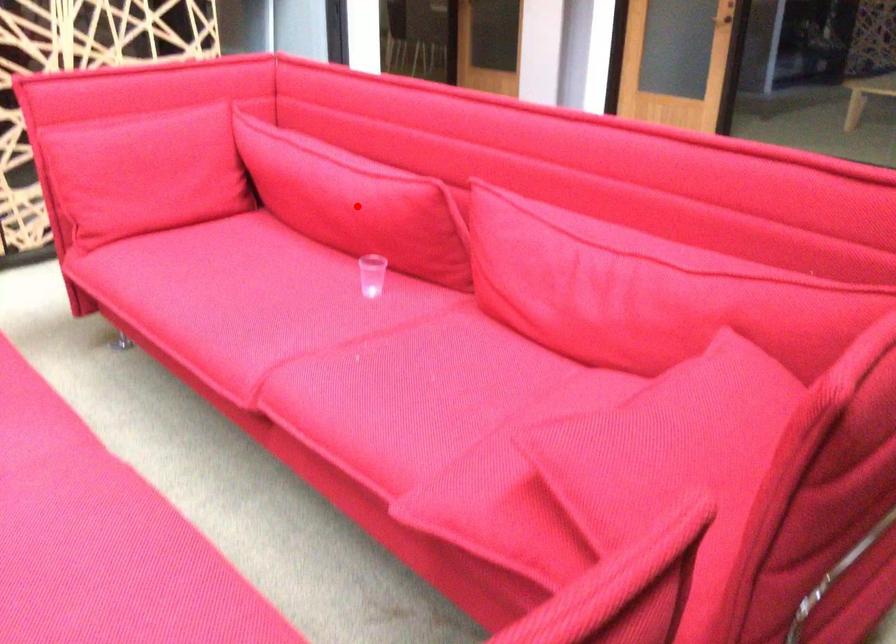
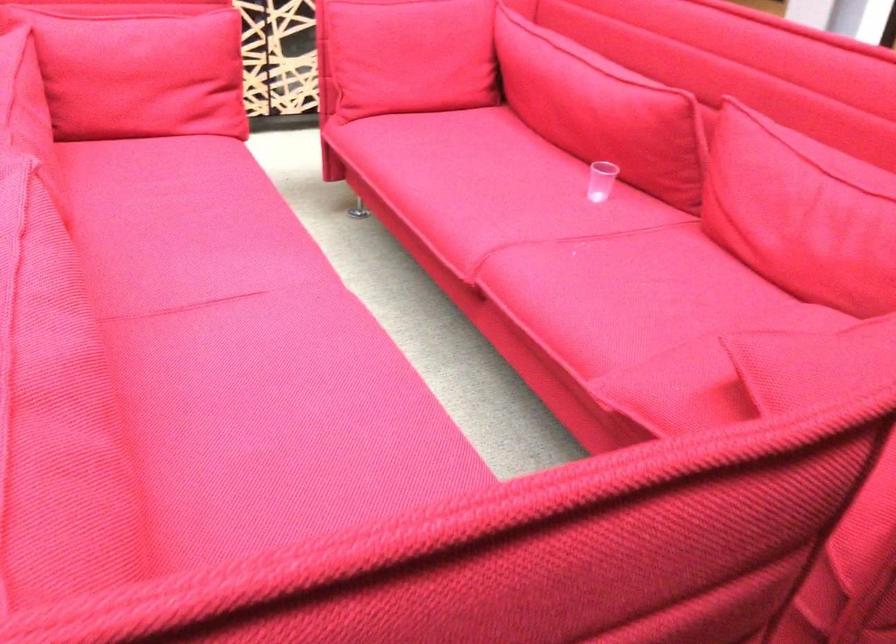
In the second image, find the point that corresponds to the highlighted location in the first image.

(601, 109)